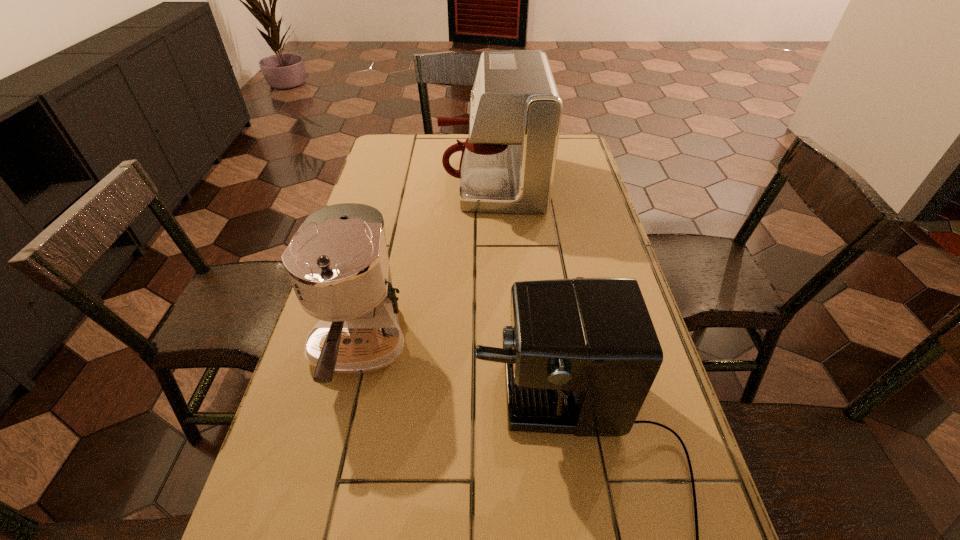
At what (x,y) coordinates should I click in order to perform the action: click on coffee maker that stands as the second closest to the shortest object. Please return your answer as a coordinate pair (x, y). Image resolution: width=960 pixels, height=540 pixels. Looking at the image, I should click on (507, 165).

Identify which coffee maker is the second closest to the second shortest coffee maker. Please provide its 2D coordinates. Your answer should be formatted as a tuple, i.e. [(x, y)], where the tuple contains the x and y coordinates of a point satisfying the conditions above.

[(507, 165)]

Where is `blank space that satisfies the following two spatial constraints: 1. on the front of the tallest object near the spout; 2. on the front-facing side of the leftmost object`? blank space that satisfies the following two spatial constraints: 1. on the front of the tallest object near the spout; 2. on the front-facing side of the leftmost object is located at coordinates (497, 349).

Where is `free space that satisfies the following two spatial constraints: 1. on the front of the tallest object near the spout; 2. on the front-facing side of the second shortest coffee maker`? This screenshot has height=540, width=960. free space that satisfies the following two spatial constraints: 1. on the front of the tallest object near the spout; 2. on the front-facing side of the second shortest coffee maker is located at coordinates (497, 349).